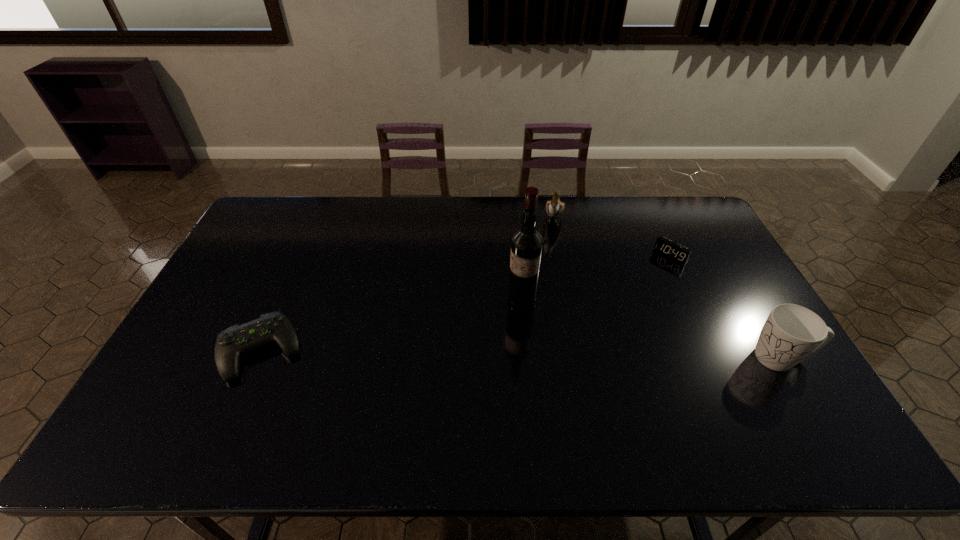
Identify the location of free spot between the bird and the second farthest object. Image resolution: width=960 pixels, height=540 pixels. (612, 236).

Where is `vacant region between the control and the second object from right to left`? The image size is (960, 540). vacant region between the control and the second object from right to left is located at coordinates (466, 303).

I want to click on free space between the second object from left to right and the rightmost object, so click(x=652, y=329).

Find the location of a particular element. vacant space that's between the control and the fourth object from right to left is located at coordinates (392, 326).

Where is `object identified as the fourth closest to the second object from right to left`? object identified as the fourth closest to the second object from right to left is located at coordinates (236, 340).

This screenshot has width=960, height=540. I want to click on object that ranks as the closest to the alarm clock, so click(554, 208).

Identify the location of vacant area in the image that satisfies the following two spatial constraints: 1. on the front side of the leftmost object; 2. on the side of the rightmost object with the handle. The width and height of the screenshot is (960, 540). (257, 357).

In order to click on vacant space that satisfies the following two spatial constraints: 1. on the front side of the rightmost object; 2. on the side of the third nearest object with the handle in this screenshot , I will do `click(527, 357)`.

Where is `free space in the image that satisfies the following two spatial constraints: 1. on the front side of the second object from right to left; 2. on the side of the mug with the handle`? The image size is (960, 540). free space in the image that satisfies the following two spatial constraints: 1. on the front side of the second object from right to left; 2. on the side of the mug with the handle is located at coordinates (718, 357).

The image size is (960, 540). What are the coordinates of `free space in the image that satisfies the following two spatial constraints: 1. on the front side of the farthest object; 2. on the left side of the second object from right to left` in the screenshot? It's located at (561, 255).